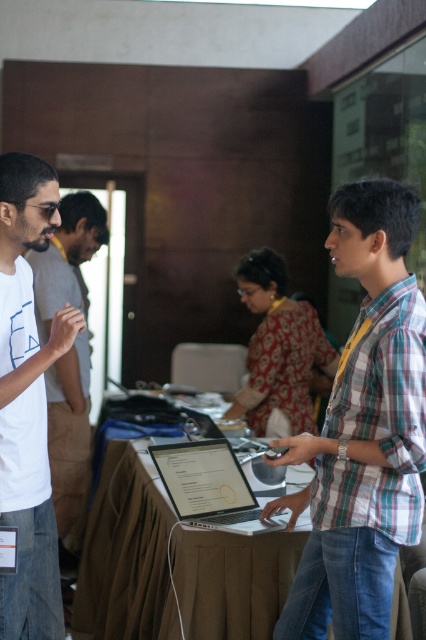
From the picture: Can you confirm if plaid cotton shirt at center is positioned to the left of light brown fabric table at center?

In fact, plaid cotton shirt at center is to the right of light brown fabric table at center.

Image resolution: width=426 pixels, height=640 pixels. Describe the element at coordinates (363, 429) in the screenshot. I see `plaid cotton shirt at center` at that location.

This screenshot has height=640, width=426. Identify the location of plaid cotton shirt at center. (363, 429).

The height and width of the screenshot is (640, 426). Describe the element at coordinates (126, 552) in the screenshot. I see `light brown fabric table at center` at that location.

Is light brown fabric table at center above white matte t-shirt at left?

No.

Image resolution: width=426 pixels, height=640 pixels. Find the location of `light brown fabric table at center`. light brown fabric table at center is located at coordinates (126, 552).

I want to click on light brown fabric table at center, so click(126, 552).

Who is lower down, plaid cotton shirt at center or white matte t-shirt at left?

plaid cotton shirt at center is lower down.

Is point (383, 376) more distant than point (8, 497)?

No, (383, 376) is closer to viewer.

Is point (388, 310) farther from camera compared to point (11, 385)?

No, it is in front of (11, 385).

Where is `plaid cotton shirt at center`? plaid cotton shirt at center is located at coordinates (363, 429).